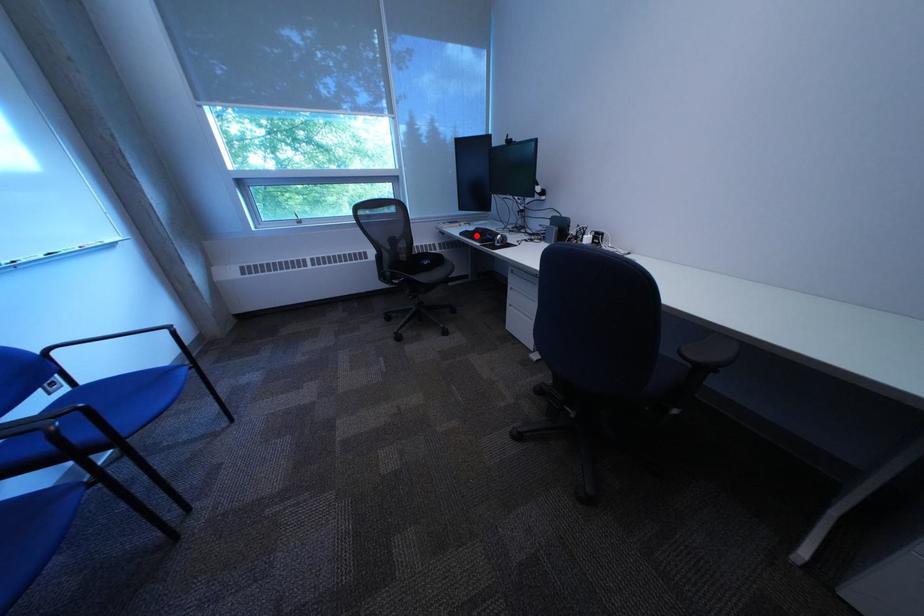
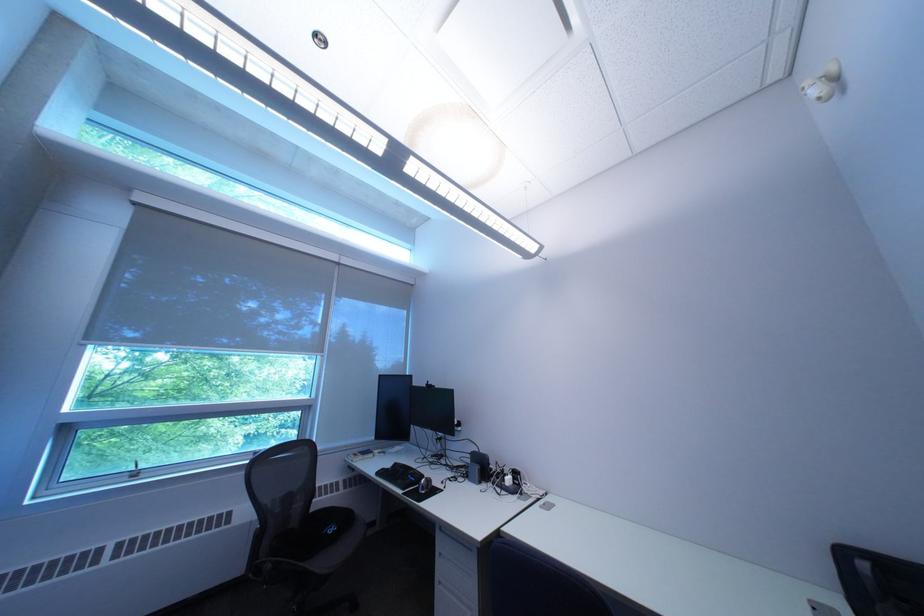
In the second image, find the point that corresponds to the highlighted location in the first image.

(393, 475)